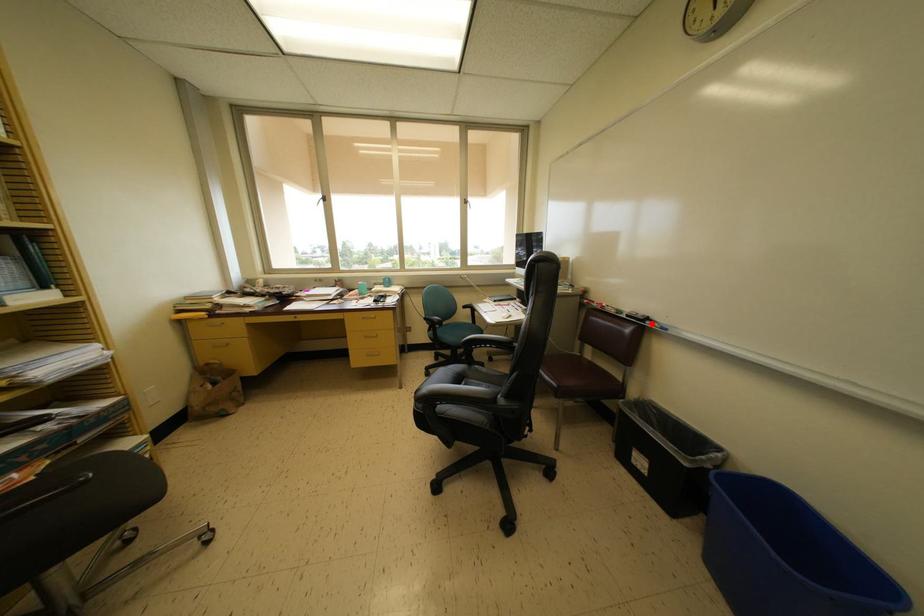
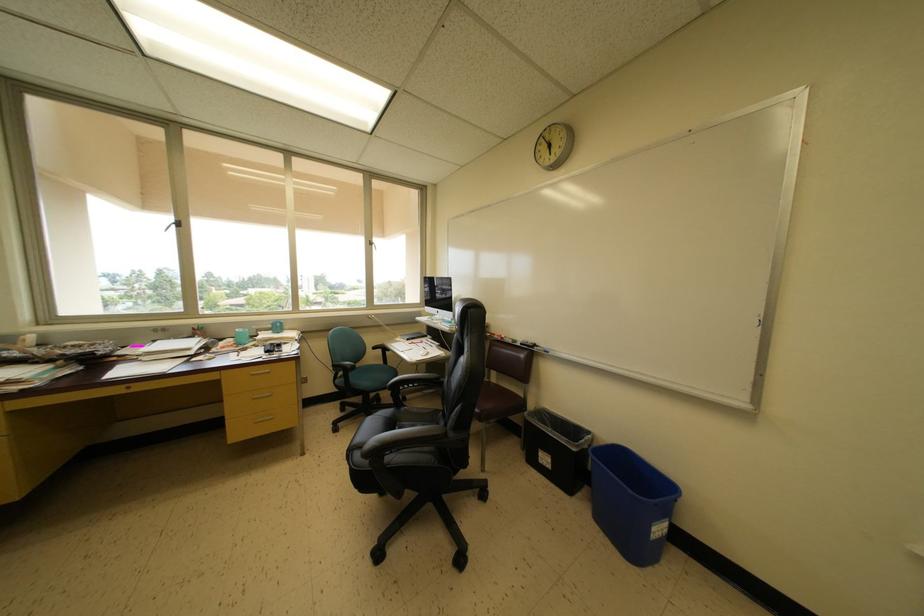
Locate, in the second image, the point that corresponds to the highlighted location in the first image.

(539, 350)